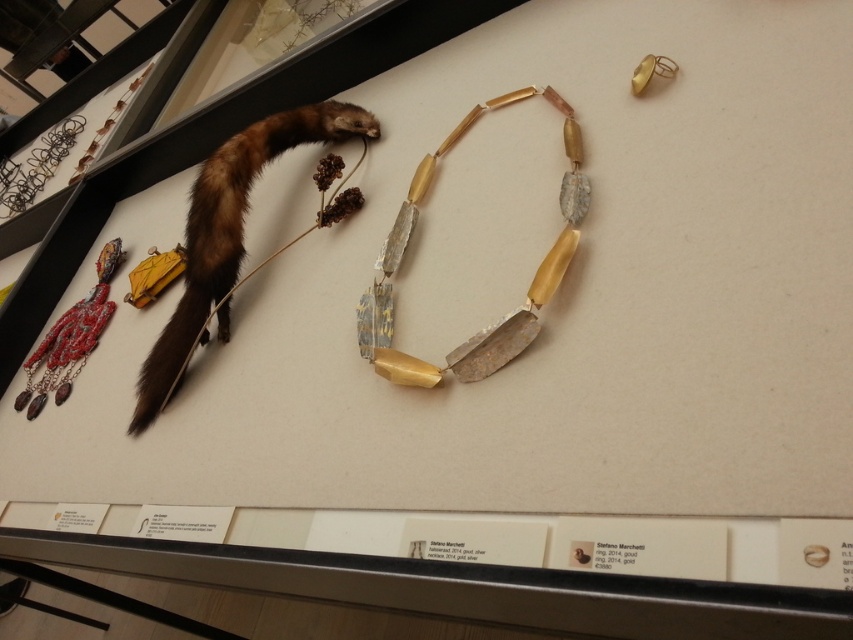
You are a photographer standing at the camera position. You want to take a closeup photo of the brown fur animal at upper left. Is it within your camera range of 30 inches?

The brown fur animal at upper left is 38.58 inches away from camera, which is beyond the camera range of 30 inches. You need to move closer to get a closeup.

You are a visitor standing in front of the display case. The museum has a rule that you must stay at least 36 inches away from the exhibits. Can you safely view the brown fur animal at upper left without violating the rule?

The brown fur animal at upper left is 38.58 inches away from the viewer, which is more than the required 36 inches. Therefore, you can safely view it without breaking the museum rule.